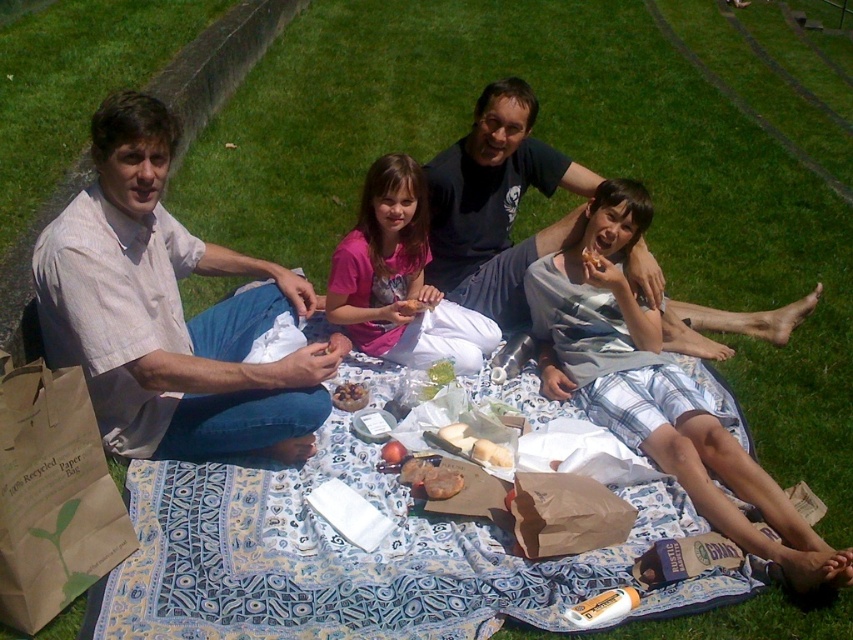
Based on the photo, you are planning to place a small toy car between the smooth chocolate bar at center and the golden brown bread at center on the picnic blanket. Based on their sizes, which item will the toy car be closer to?

The smooth chocolate bar at center is shorter than the golden brown bread at center, so the toy car will be closer to the smooth chocolate bar at center since it is shorter and likely occupies less space between them.

You are a photographer standing at the camera position. You want to take a closeup shot of the smooth chocolate bar at center. However, your camera can only focus on objects within 10 feet. Can you take the photo without moving closer?

Result: The smooth chocolate bar at center is 10.80 feet away from the camera. Since the camera can only focus within 10 feet, you cannot take the photo without moving closer.